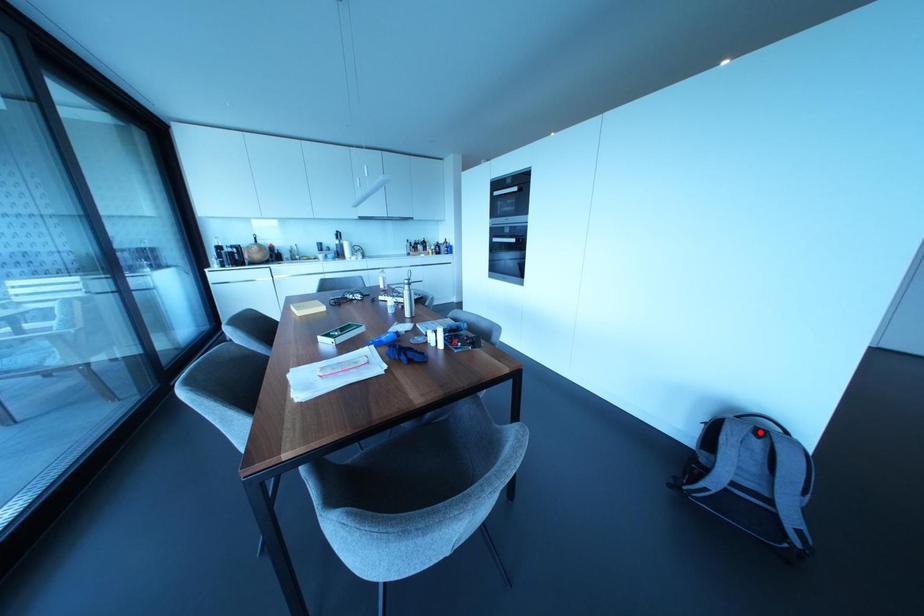
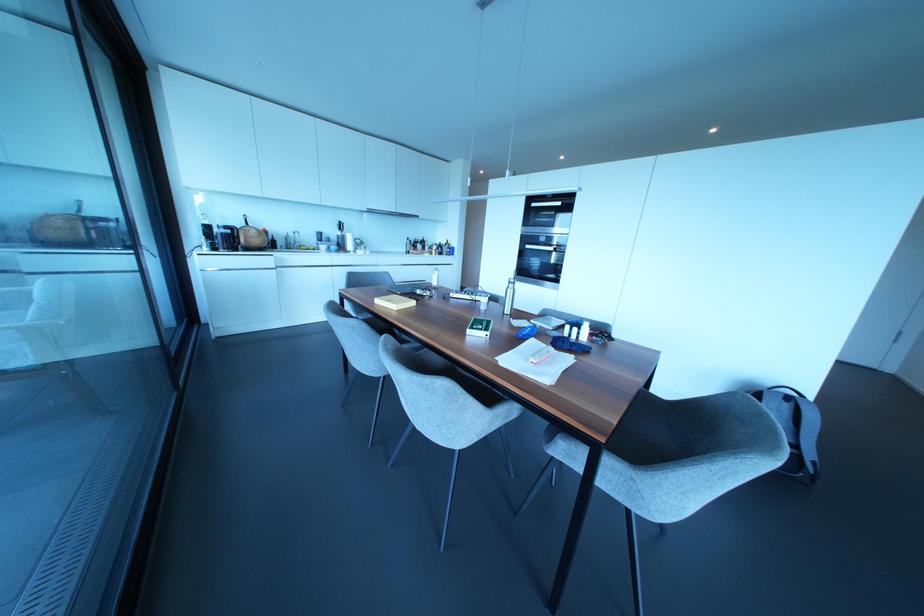
Locate, in the second image, the point that corresponds to the highlighted location in the first image.

(787, 397)